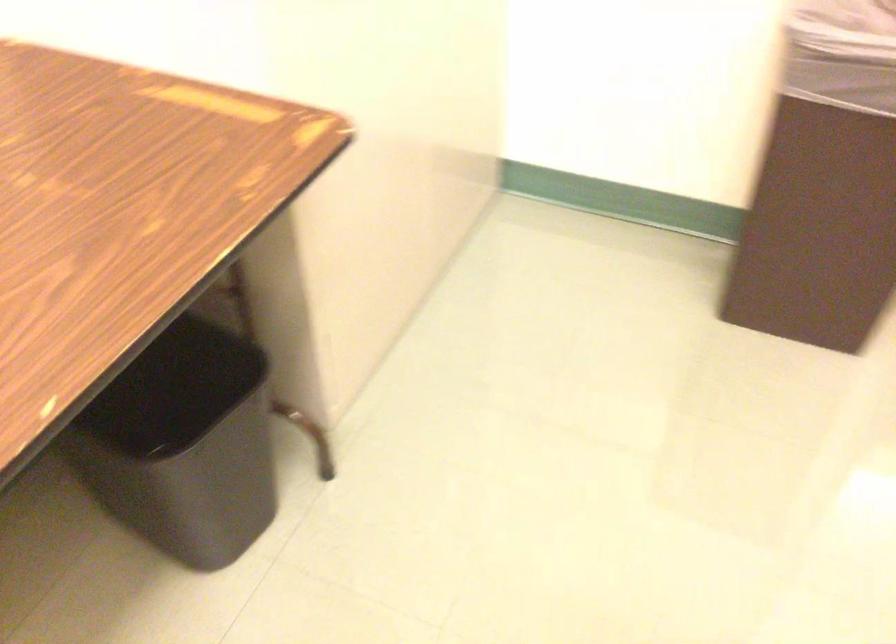
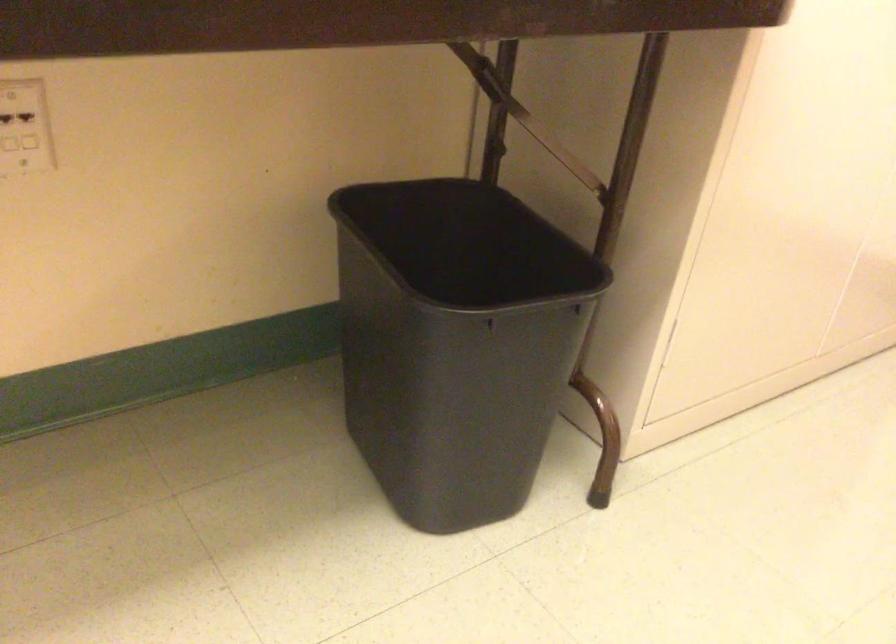
Question: The camera is either moving clockwise (left) or counter-clockwise (right) around the object. The first image is from the beginning of the video and the second image is from the end. Is the camera moving left or right when shooting the video?

Choices:
 (A) Left
 (B) Right

Answer: (B)